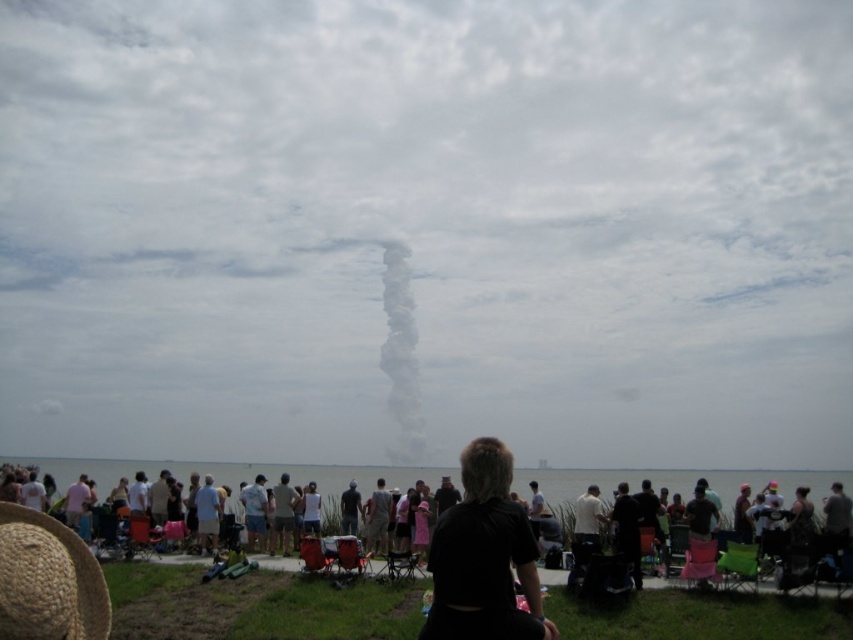
You are a photographer at the event and want to capture a photo of the dark gray shirt at center and the white fluffy smoke at center. Based on their positions, can you tell if the smoke is visible above the shirt in the photo?

The white fluffy smoke at center is above the dark gray shirt at center, so yes, the smoke will be visible above the shirt in the photo.

You are standing at the public event and want to walk from point A to point B. Point A is at coordinate point[376,268] and point B is at coordinate point[403,387]. Which point is closer to you?

Point A at coordinate point[376,268] is closer to you because it is further to the viewer than point B at coordinate point[403,387].